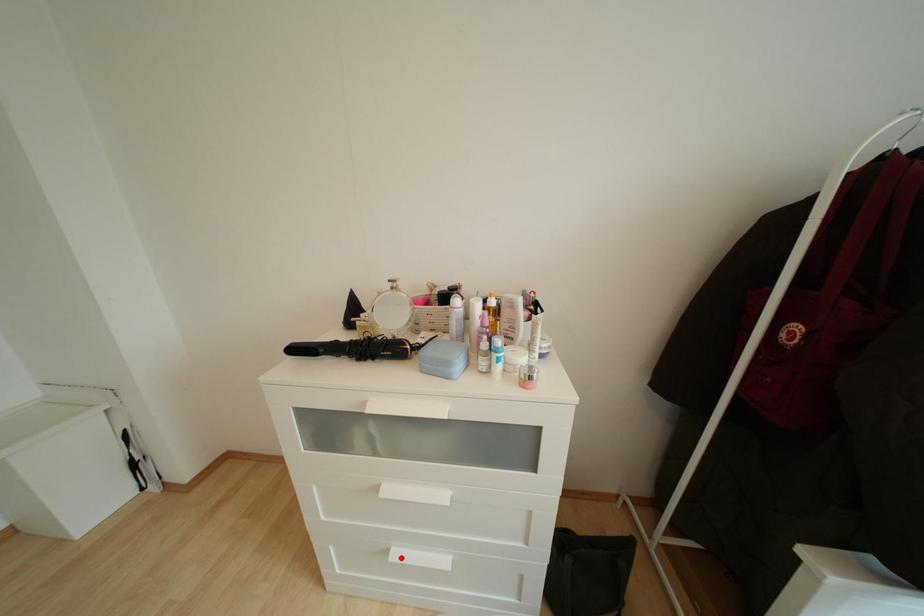
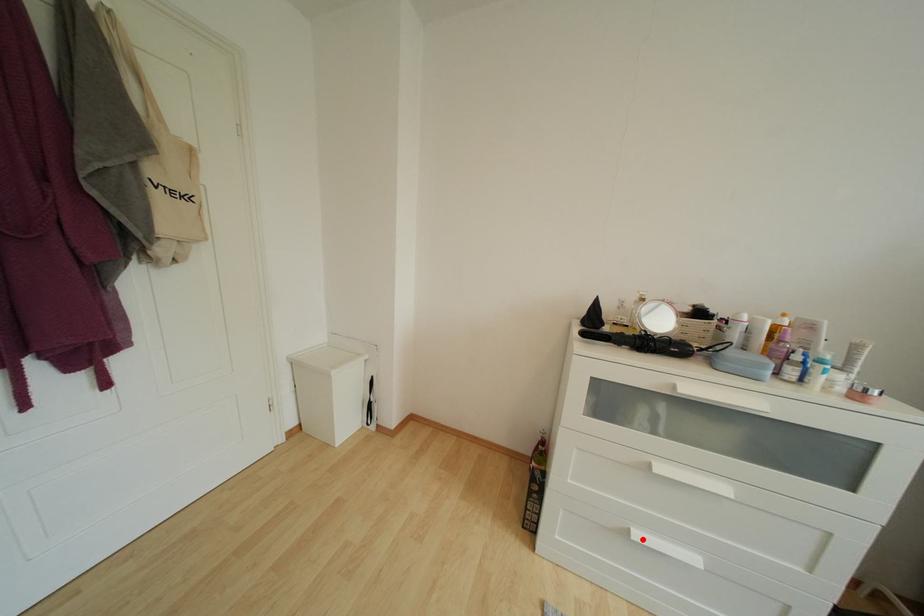
I am providing you with two images of the same scene from different viewpoints. A red point is marked on the first image and another point is marked on the second image. Is the marked point in image1 the same physical position as the marked point in image2?

Yes